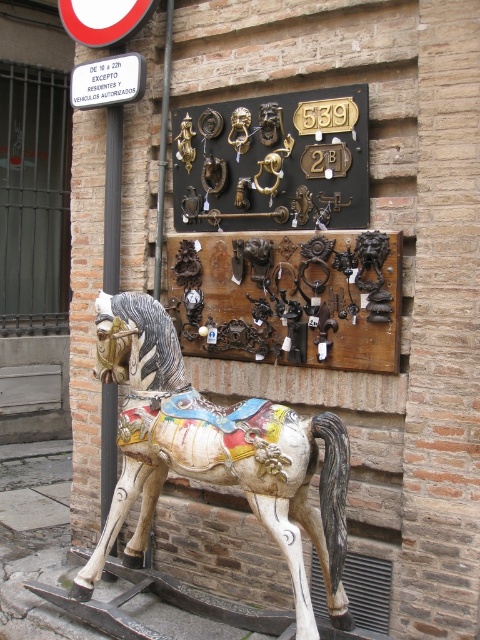
Can you confirm if red plastic circle at upper left is positioned to the right of white plastic sign at upper left?

Incorrect, red plastic circle at upper left is not on the right side of white plastic sign at upper left.

Is red plastic circle at upper left smaller than white plastic sign at upper left?

No, red plastic circle at upper left is not smaller than white plastic sign at upper left.

Which is in front, point (119, 17) or point (80, 108)?

Point (119, 17) is more forward.

Find the location of a particular element. This screenshot has width=480, height=640. red plastic circle at upper left is located at coordinates (103, 19).

Does point (263, 333) come farther from viewer compared to point (112, 282)?

No, it is not.

Which is more to the right, brown wooden door handles at center or black metal pole at left?

From the viewer's perspective, brown wooden door handles at center appears more on the right side.

Which is behind, point (313, 266) or point (116, 246)?

Positioned behind is point (116, 246).

Locate an element on the screen. This screenshot has width=480, height=640. brown wooden door handles at center is located at coordinates (288, 296).

Measure the distance between point (141, 298) and camera.

A distance of 3.15 meters exists between point (141, 298) and camera.

Is painted wood horse at center thinner than black metal pole at left?

No.

Between point (333, 477) and point (116, 412), which one is positioned in front?

Positioned in front is point (333, 477).

Find the location of a particular element. This screenshot has height=640, width=480. painted wood horse at center is located at coordinates (222, 460).